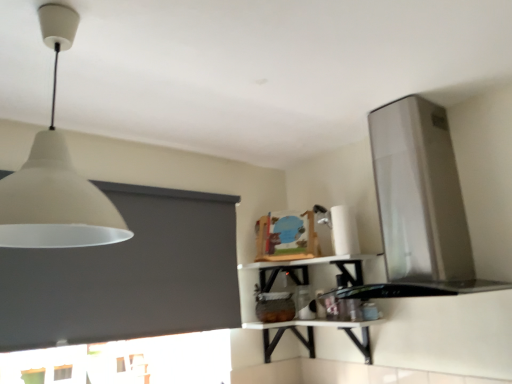
Question: From the image's perspective, is white glossy shelf at upper center located beneath white glossy table at center?

Choices:
 (A) no
 (B) yes

Answer: (A)

Question: Is the depth of white glossy shelf at upper center greater than that of white glossy table at center?

Choices:
 (A) no
 (B) yes

Answer: (B)

Question: Is white glossy shelf at upper center not close to white glossy table at center?

Choices:
 (A) no
 (B) yes

Answer: (A)

Question: Can you confirm if white glossy shelf at upper center is positioned to the left of white glossy table at center?

Choices:
 (A) no
 (B) yes

Answer: (B)

Question: Considering the relative sizes of white glossy shelf at upper center and white glossy table at center in the image provided, is white glossy shelf at upper center thinner than white glossy table at center?

Choices:
 (A) no
 (B) yes

Answer: (A)

Question: From the image's perspective, is white matte lampshade at upper left above or below white glossy counter top at lower center?

Choices:
 (A) above
 (B) below

Answer: (A)

Question: From a real-world perspective, relative to white glossy counter top at lower center, is white matte lampshade at upper left vertically above or below?

Choices:
 (A) below
 (B) above

Answer: (B)

Question: Is white matte lampshade at upper left in front of or behind white glossy counter top at lower center in the image?

Choices:
 (A) front
 (B) behind

Answer: (A)

Question: Considering the positions of white matte lampshade at upper left and white glossy counter top at lower center in the image, is white matte lampshade at upper left bigger or smaller than white glossy counter top at lower center?

Choices:
 (A) small
 (B) big

Answer: (B)

Question: From a real-world perspective, is white glossy table at center above or below satin silver vent at upper right?

Choices:
 (A) below
 (B) above

Answer: (A)

Question: Is white glossy table at center spatially inside satin silver vent at upper right, or outside of it?

Choices:
 (A) inside
 (B) outside

Answer: (B)

Question: Considering their positions, is white glossy table at center located in front of or behind satin silver vent at upper right?

Choices:
 (A) behind
 (B) front

Answer: (A)

Question: Does point (289, 324) appear closer or farther from the camera than point (440, 195)?

Choices:
 (A) closer
 (B) farther

Answer: (B)

Question: Choose the correct answer: Is white glossy counter top at lower center inside satin silver vent at upper right or outside it?

Choices:
 (A) inside
 (B) outside

Answer: (B)

Question: From the image's perspective, is white glossy counter top at lower center above or below satin silver vent at upper right?

Choices:
 (A) below
 (B) above

Answer: (A)